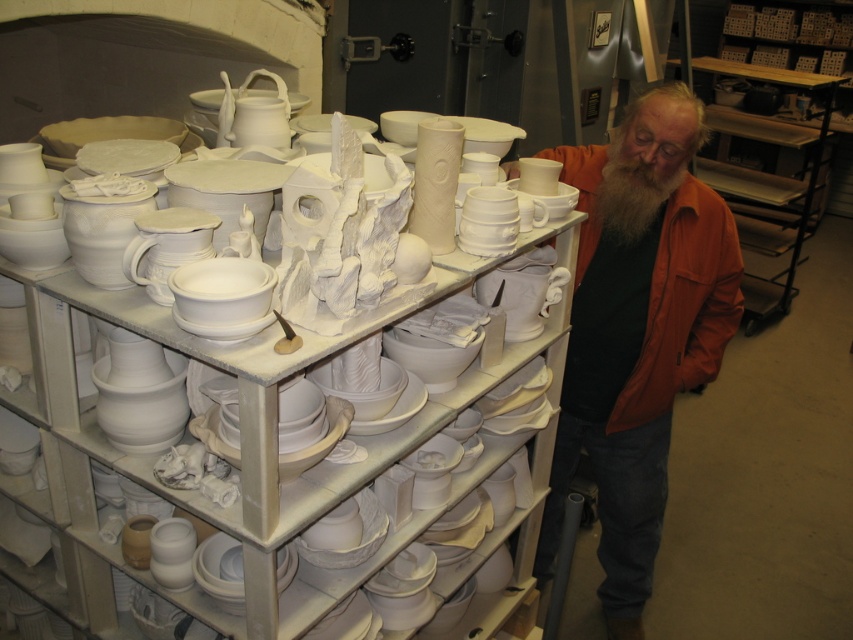
Identify the location of white matte ceramics at center. (264, 467).

Who is positioned more to the left, white matte ceramics at center or orange leather jacket at right?

white matte ceramics at center is more to the left.

You are a GUI agent. You are given a task and a screenshot of the screen. Output one action in this format:
    pyautogui.click(x=<x>, y=<y>)
    Task: Click on the white matte ceramics at center
    The image size is (853, 640).
    Given the screenshot: What is the action you would take?
    pyautogui.click(x=264, y=467)

Which of these two, orange leather jacket at right or wooden at right, stands taller?

With more height is wooden at right.

From the picture: Who is more distant from viewer, (669, 380) or (750, 200)?

Point (750, 200)

Where is `orange leather jacket at right`? This screenshot has width=853, height=640. orange leather jacket at right is located at coordinates (637, 332).

Does white matte ceramics at center lie in front of white matte beard at center?

Yes, white matte ceramics at center is in front of white matte beard at center.

Does white matte ceramics at center appear on the left side of white matte beard at center?

Correct, you'll find white matte ceramics at center to the left of white matte beard at center.

Between point (230, 461) and point (664, 177), which one is positioned in front?

Point (230, 461) is in front.

Locate an element on the screen. Image resolution: width=853 pixels, height=640 pixels. white matte ceramics at center is located at coordinates (264, 467).